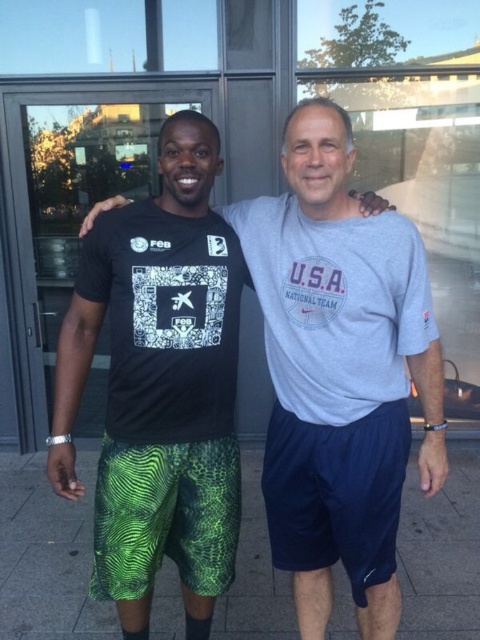
Question: Is black matte t-shirt at left further to the viewer compared to navy blue fabric shorts at center?

Choices:
 (A) no
 (B) yes

Answer: (A)

Question: Which point appears farthest from the camera in this image?

Choices:
 (A) (383, 595)
 (B) (61, 616)
 (C) (277, 522)

Answer: (B)

Question: Which of these objects is positioned closest to the green fabric shorts at lower center?

Choices:
 (A) black matte t-shirt at left
 (B) navy blue fabric shorts at center

Answer: (B)

Question: Based on their relative distances, which object is nearer to the navy blue fabric shorts at center?

Choices:
 (A) green fabric shorts at lower center
 (B) black matte t-shirt at left

Answer: (B)

Question: Can you confirm if black matte t-shirt at left is smaller than green fabric shorts at lower center?

Choices:
 (A) yes
 (B) no

Answer: (A)

Question: Observing the image, what is the correct spatial positioning of black matte t-shirt at left in reference to navy blue fabric shorts at center?

Choices:
 (A) below
 (B) above

Answer: (B)